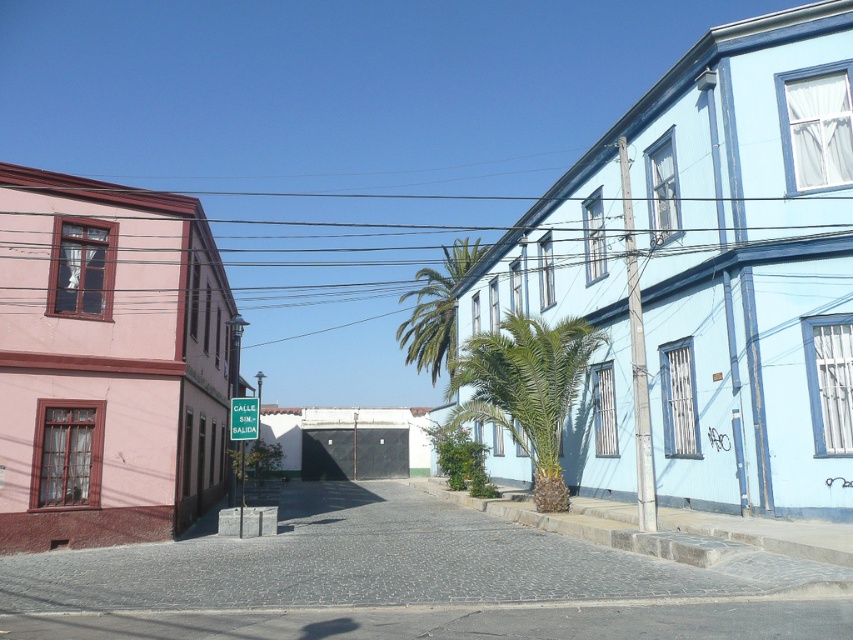
You are standing at the entrance of the pinkish building on the left side of the street. You see a green leafy palm at center and a green plastic sign at center. Which object is closer to the white wall at the end of the street?

The green leafy palm at center is to the right of the green plastic sign at center. Since both are at the center of the street, the green plastic sign at center is closer to the white wall at the end of the street because it is positioned to the left of the palm tree, and the street leads directly towards the wall.

You are a delivery person driving a van that is 2 meters tall. You arrive at this narrow street and see the green leafy palm tree at center and the green plastic sign at center. Can your van pass under the lowest point between these two objects without hitting anything?

The green leafy palm tree at center is much taller than the green plastic sign at center, so the lowest point between them is likely near the green plastic sign at center. Since the van is 2 meters tall, you need to check if the sign is higher than 2 meters. However, the exact height isn not provided, so it is uncertain whether the van can pass safely.

From the picture: You are standing at the entrance of the pinkish pink building with a reddish brown roof on the left side of the street. You want to walk straight ahead towards the white wall at the end of the narrow street. There is a green leafy palm at center located at point (527, 388). Will you pass by the green leafy palm at center before reaching the white wall?

Yes, the green leafy palm at center is located at point (527, 388), which is along the path towards the white wall. Since the palm is positioned before the end of the street, you will pass by it before reaching the white wall.